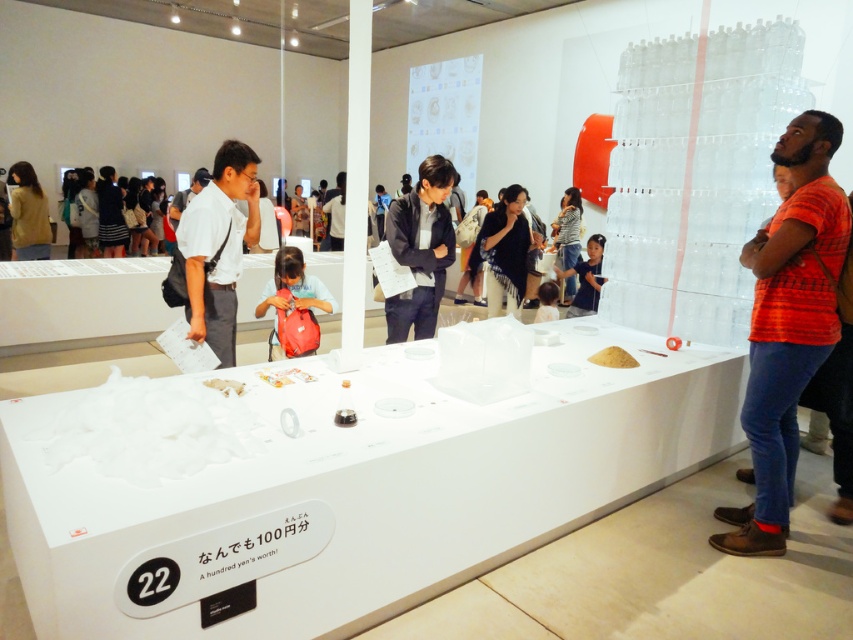
You are a visitor at the exhibition and want to take a photo of the white shirt at center without the striped shirt at center appearing in the background. Given that your camera has a maximum zoom range of 10 meters, can you achieve this?

The distance between the white shirt at center and striped shirt at center is 5.13 meters. Since your camera can zoom up to 10 meters, you can zoom in enough to frame the white shirt at center while excluding the striped shirt at center from the shot.

You are standing in the exhibition space and want to take a photo of the dark gray jacket at center without moving it. Your camera is 3.28 meters away from the jacket. Is the distance sufficient to capture the entire jacket in one shot?

The dark gray jacket at center and camera are 3.28 meters apart, so the distance is sufficient to capture the entire jacket in one shot.

You are standing in the exhibition space and want to take a photo of both the white rectangular table labeled 22 and the area where the two points are located. Which point, point (450, 177) or point (503, 284), will appear larger in your photo?

Point (450, 177) will appear larger in the photo because it is closer to the camera than point (503, 284).